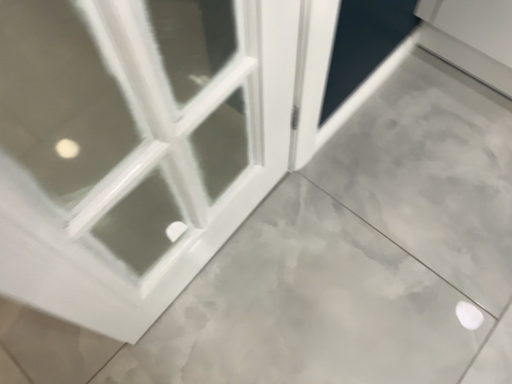
What is the approximate height of white glossy screen door at upper right?

It is 3.17 inches.

Describe the element at coordinates (311, 75) in the screenshot. I see `white glossy screen door at upper right` at that location.

The image size is (512, 384). Find the location of `white glossy screen door at upper right`. white glossy screen door at upper right is located at coordinates (311, 75).

What do you see at coordinates (131, 152) in the screenshot?
I see `white glossy door at upper left` at bounding box center [131, 152].

Measure the distance between point (143, 308) and camera.

Point (143, 308) is 34.92 inches away from camera.

Where is `white glossy door at upper left`? The width and height of the screenshot is (512, 384). white glossy door at upper left is located at coordinates tap(131, 152).

I want to click on white glossy screen door at upper right, so click(x=311, y=75).

Is white glossy door at upper left to the left of white glossy screen door at upper right from the viewer's perspective?

Correct, you'll find white glossy door at upper left to the left of white glossy screen door at upper right.

Considering their positions, is white glossy door at upper left located in front of or behind white glossy screen door at upper right?

Visually, white glossy door at upper left is located in front of white glossy screen door at upper right.

Considering the points (97, 221) and (320, 85), which point is behind, point (97, 221) or point (320, 85)?

The point (320, 85) is farther.

From the image's perspective, is white glossy door at upper left above or below white glossy screen door at upper right?

white glossy door at upper left is below white glossy screen door at upper right.

From a real-world perspective, does white glossy door at upper left stand above white glossy screen door at upper right?

No, from a real-world perspective, white glossy door at upper left is not above white glossy screen door at upper right.

Considering the sizes of objects white glossy door at upper left and white glossy screen door at upper right in the image provided, who is wider, white glossy door at upper left or white glossy screen door at upper right?

white glossy door at upper left.

Can you confirm if white glossy door at upper left is shorter than white glossy screen door at upper right?

Yes.

Which of these two, white glossy door at upper left or white glossy screen door at upper right, is smaller?

With smaller size is white glossy screen door at upper right.

Looking at this image, is white glossy door at upper left not within white glossy screen door at upper right?

Absolutely, white glossy door at upper left is external to white glossy screen door at upper right.

Is white glossy door at upper left far away from white glossy screen door at upper right?

No, white glossy door at upper left is not far away from white glossy screen door at upper right.

Could you tell me if white glossy door at upper left is facing white glossy screen door at upper right?

No, white glossy door at upper left is not oriented towards white glossy screen door at upper right.

You are a GUI agent. You are given a task and a screenshot of the screen. Output one action in this format:
    pyautogui.click(x=<x>, y=<y>)
    Task: Click on the window that appears in front of the white glossy screen door at upper right
    This screenshot has height=384, width=512.
    Given the screenshot: What is the action you would take?
    pyautogui.click(x=131, y=152)

Considering the relative positions of white glossy screen door at upper right and white glossy door at upper left in the image provided, is white glossy screen door at upper right to the right of white glossy door at upper left from the viewer's perspective?

Correct, you'll find white glossy screen door at upper right to the right of white glossy door at upper left.

Considering the relative positions of white glossy screen door at upper right and white glossy door at upper left in the image provided, is white glossy screen door at upper right in front of white glossy door at upper left?

No, the depth of white glossy screen door at upper right is greater than that of white glossy door at upper left.

Which is farther, [306,158] or [218,185]?

The point [306,158] is farther.

Looking at this image, from the image's perspective, does white glossy screen door at upper right appear higher than white glossy door at upper left?

Indeed, from the image's perspective, white glossy screen door at upper right is shown above white glossy door at upper left.

From a real-world perspective, is white glossy screen door at upper right above or below white glossy door at upper left?

Clearly, from a real-world perspective, white glossy screen door at upper right is above white glossy door at upper left.

Consider the image. Considering the sizes of white glossy screen door at upper right and white glossy door at upper left in the image, is white glossy screen door at upper right wider or thinner than white glossy door at upper left?

In the image, white glossy screen door at upper right appears to be more narrow than white glossy door at upper left.

Between white glossy screen door at upper right and white glossy door at upper left, which one has more height?

white glossy screen door at upper right is taller.

Does white glossy screen door at upper right have a larger size compared to white glossy door at upper left?

No.

Is white glossy screen door at upper right inside or outside of white glossy door at upper left?

white glossy screen door at upper right is spatially situated outside white glossy door at upper left.

Is white glossy screen door at upper right positioned far away from white glossy door at upper left?

No, white glossy screen door at upper right is not far away from white glossy door at upper left.

Is white glossy screen door at upper right aimed at white glossy door at upper left?

No, white glossy screen door at upper right is not aimed at white glossy door at upper left.

Locate an element on the screen. This screenshot has width=512, height=384. screen door located behind the white glossy door at upper left is located at coordinates (311, 75).

Image resolution: width=512 pixels, height=384 pixels. In order to click on window directly beneath the white glossy screen door at upper right (from a real-world perspective) in this screenshot , I will do `click(131, 152)`.

The image size is (512, 384). I want to click on screen door above the white glossy door at upper left (from a real-world perspective), so click(x=311, y=75).